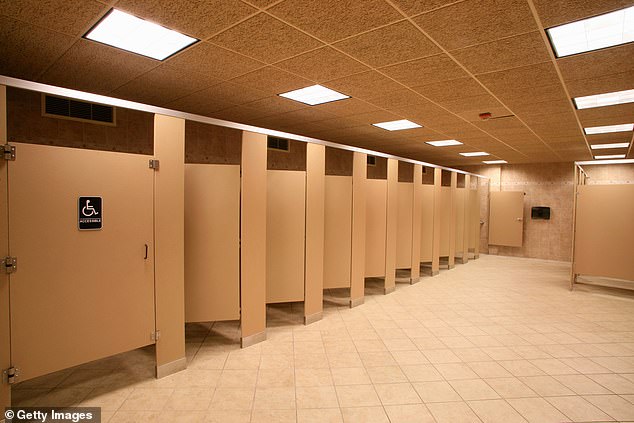
The image size is (634, 423). In order to click on beige tile floor in this screenshot , I will do `click(399, 347)`.